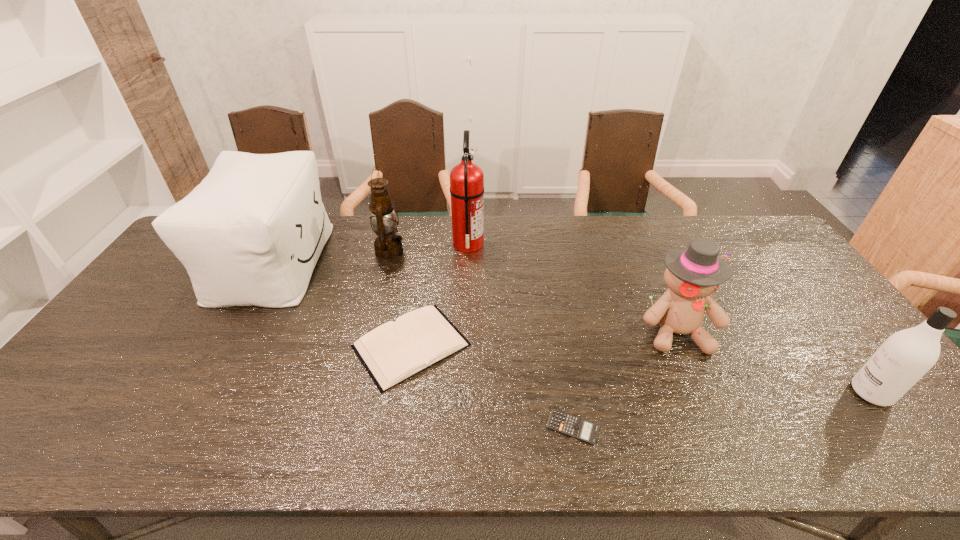
Where is `object that is at the near edge`? Image resolution: width=960 pixels, height=540 pixels. object that is at the near edge is located at coordinates (570, 425).

Locate an element on the screen. This screenshot has width=960, height=540. object situated at the right edge is located at coordinates (906, 356).

Find the location of a particular element. This screenshot has width=960, height=540. free region at the far edge is located at coordinates (422, 241).

In the image, there is a desktop. At what (x,y) coordinates should I click in order to perform the action: click on vacant space at the near edge. Please return your answer as a coordinate pair (x, y). The height and width of the screenshot is (540, 960). Looking at the image, I should click on (135, 440).

Identify the location of free space at the left edge. The image size is (960, 540). (86, 377).

Locate an element on the screen. unoccupied area between the leftmost object and the sixth object from left to right is located at coordinates (474, 296).

What are the coordinates of `empty location between the rightmost object and the shortest object` in the screenshot? It's located at (722, 410).

The width and height of the screenshot is (960, 540). In order to click on vacant area that lies between the oil lamp and the sixth object from left to right in this screenshot , I will do `click(533, 292)`.

Identify the location of free space between the rag_doll and the rightmost object. (774, 362).

Where is `empty space between the second object from right to left and the nearest object`? This screenshot has width=960, height=540. empty space between the second object from right to left and the nearest object is located at coordinates (624, 379).